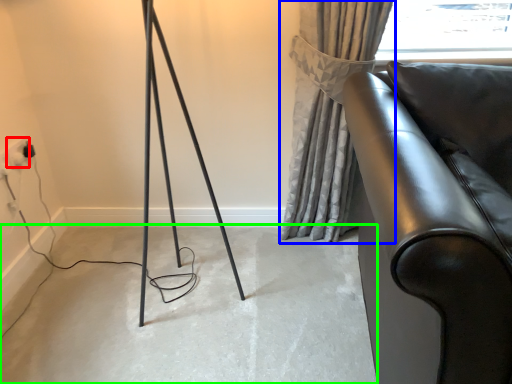
Question: Which is farther away from electric outlet (highlighted by a red box)? curtain (highlighted by a blue box) or concrete (highlighted by a green box)?

Choices:
 (A) curtain
 (B) concrete

Answer: (A)